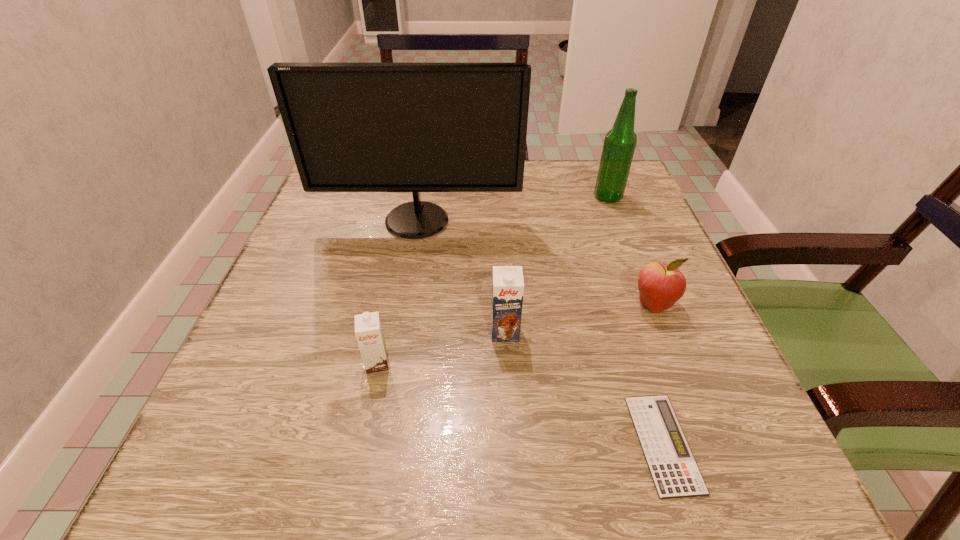
At what (x,y) coordinates should I click in order to perform the action: click on free space that is in between the fourth nearest object and the calculator. Please return your answer as a coordinate pair (x, y). Looking at the image, I should click on (658, 374).

Where is `vacant area that lies between the beer bottle and the tallest object`? The image size is (960, 540). vacant area that lies between the beer bottle and the tallest object is located at coordinates (513, 209).

Image resolution: width=960 pixels, height=540 pixels. I want to click on empty location between the second tallest object and the tallest object, so click(513, 209).

Select which object is the fifth closest to the fifth shortest object. Please provide its 2D coordinates. Your answer should be formatted as a tuple, i.e. [(x, y)], where the tuple contains the x and y coordinates of a point satisfying the conditions above.

[(368, 330)]

At what (x,y) coordinates should I click in order to perform the action: click on object that can be found as the fifth closest to the second tallest object. Please return your answer as a coordinate pair (x, y). This screenshot has width=960, height=540. Looking at the image, I should click on (368, 330).

Identify the location of free region that satisfies the following two spatial constraints: 1. on the front label of the right chocolate milk; 2. on the left side of the nearest object. This screenshot has width=960, height=540. click(x=511, y=443).

Where is `vacant position in the image that satisfies the following two spatial constraints: 1. on the front-facing side of the tallest object; 2. on the right side of the apple`? This screenshot has width=960, height=540. vacant position in the image that satisfies the following two spatial constraints: 1. on the front-facing side of the tallest object; 2. on the right side of the apple is located at coordinates (402, 304).

Locate an element on the screen. free location that satisfies the following two spatial constraints: 1. on the label of the beer bottle; 2. on the back side of the third farthest object is located at coordinates (649, 304).

You are a GUI agent. You are given a task and a screenshot of the screen. Output one action in this format:
    pyautogui.click(x=<x>, y=<y>)
    Task: Click on the free location that satisfies the following two spatial constraints: 1. on the label of the third farthest object; 2. on the left side of the beer bottle
    This screenshot has height=540, width=960.
    Given the screenshot: What is the action you would take?
    pyautogui.click(x=649, y=304)

Find the location of a particular element. Image resolution: width=960 pixels, height=540 pixels. free spot that satisfies the following two spatial constraints: 1. on the front-facing side of the apple; 2. on the left side of the tallest object is located at coordinates [402, 304].